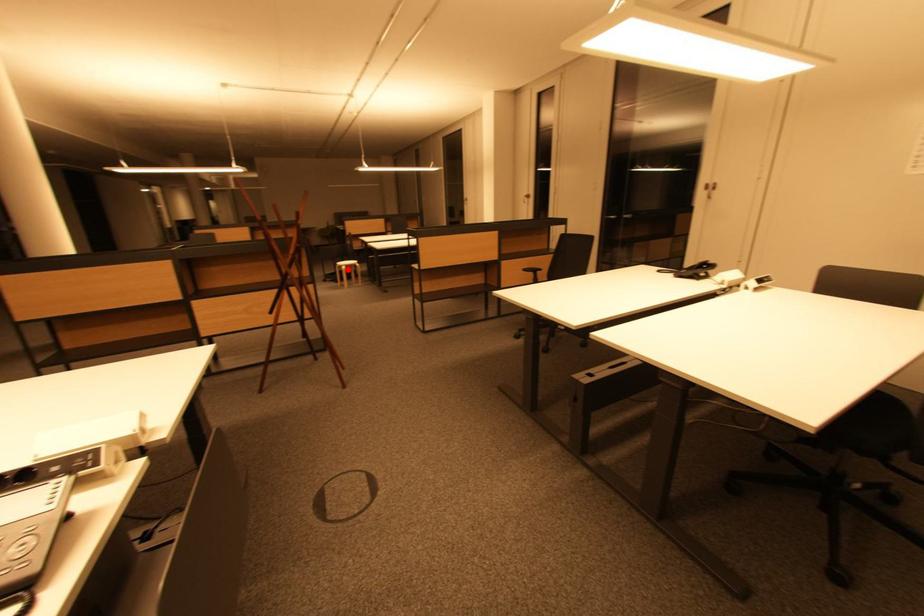
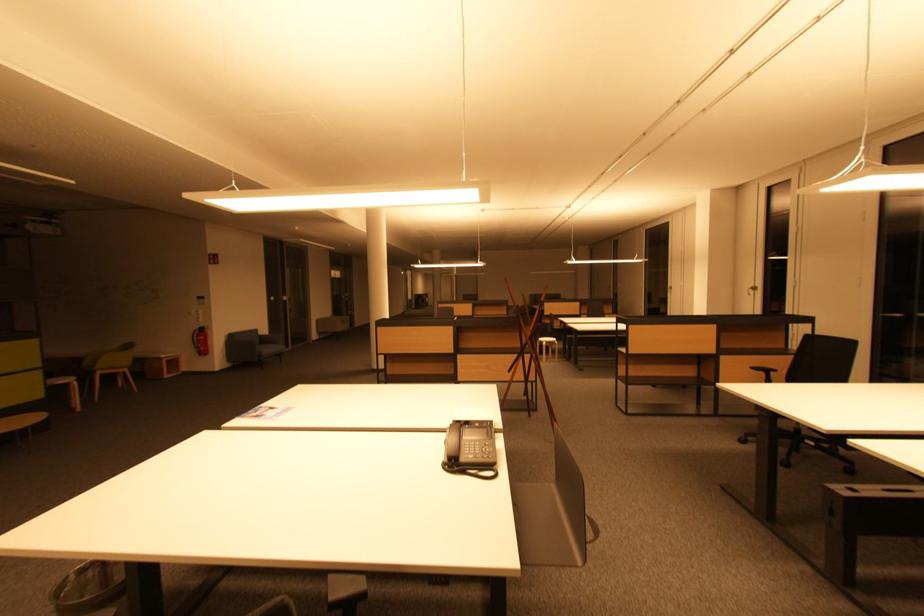
Question: I am providing you with two images of the same scene from different viewpoints. In image1, a red point is highlighted. Considering the same 3D point in image2, which of the following is correct?

Choices:
 (A) It is closer
 (B) It is farther

Answer: (B)